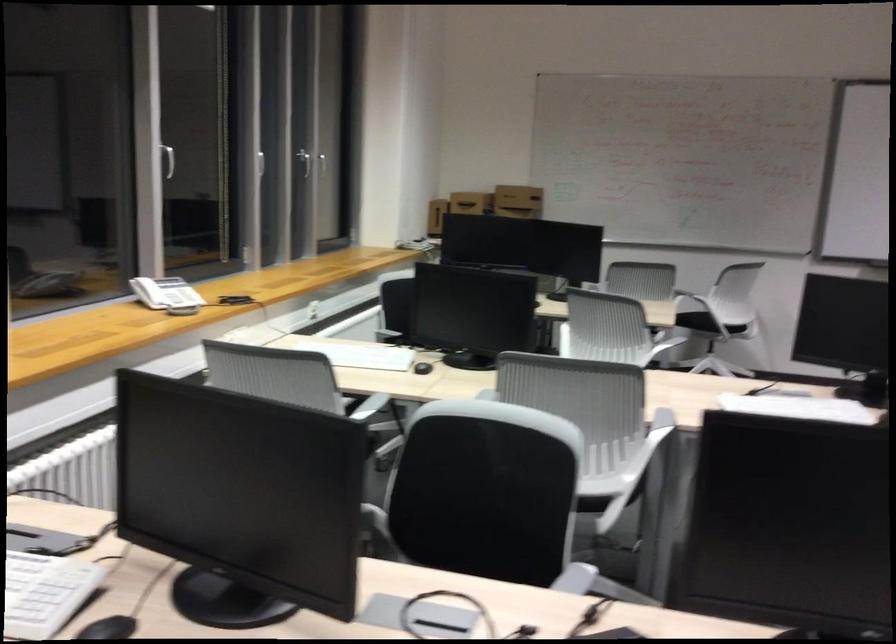
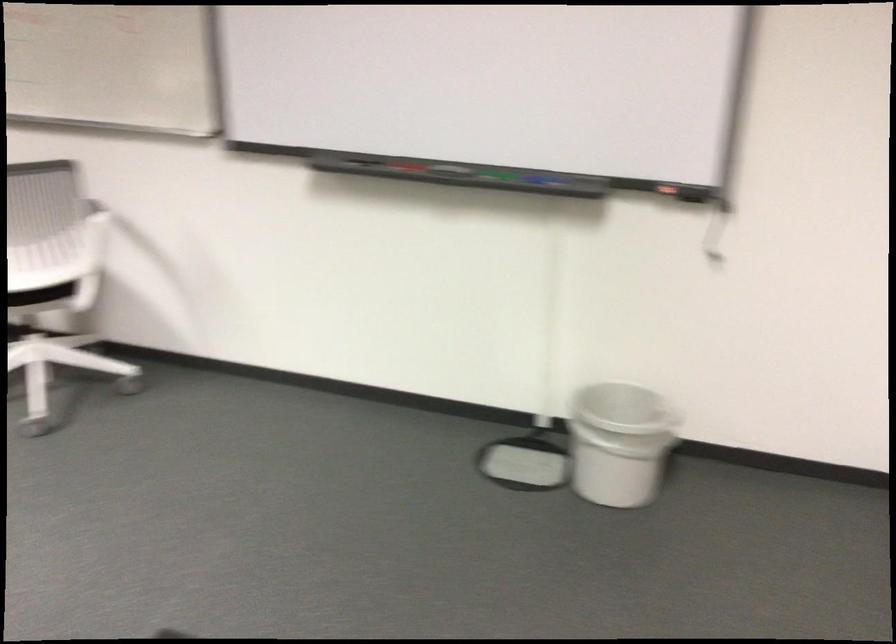
Where in the second image is the point corresponding to (764,310) from the first image?

(40, 295)